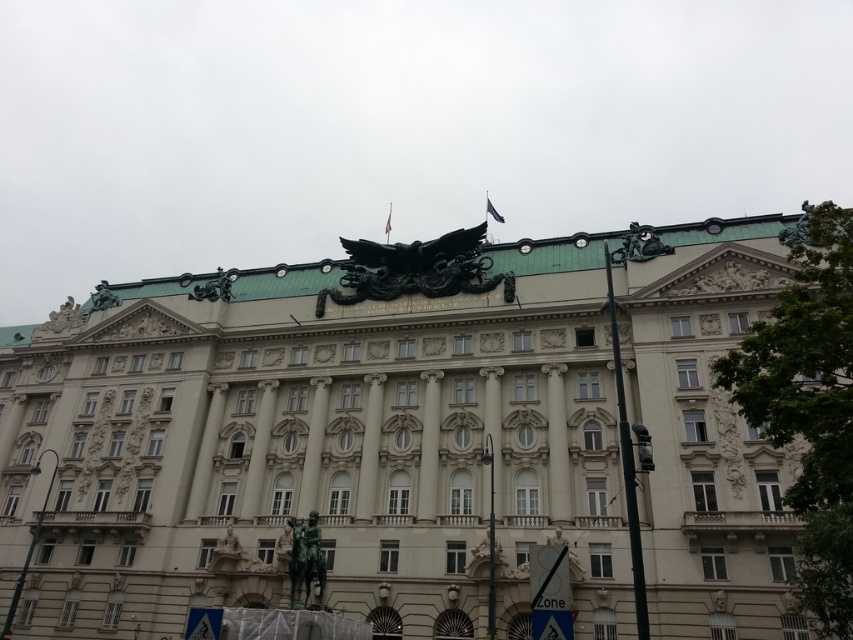
You are standing in front of the grand neoclassical building and want to determine the relative positions of two points marked on the facade. Which point, point (654, 232) or point (234, 272), is closer to you?

Point (654, 232) is closer to the viewer than point (234, 272).